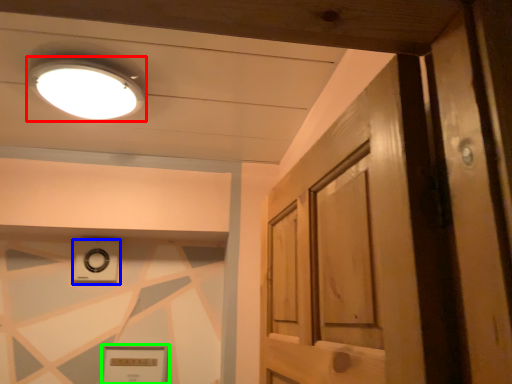
Question: Which object is the closest to the lighting (highlighted by a red box)? Choose among these: knob (highlighted by a blue box) or picture frame (highlighted by a green box).

Choices:
 (A) knob
 (B) picture frame

Answer: (A)